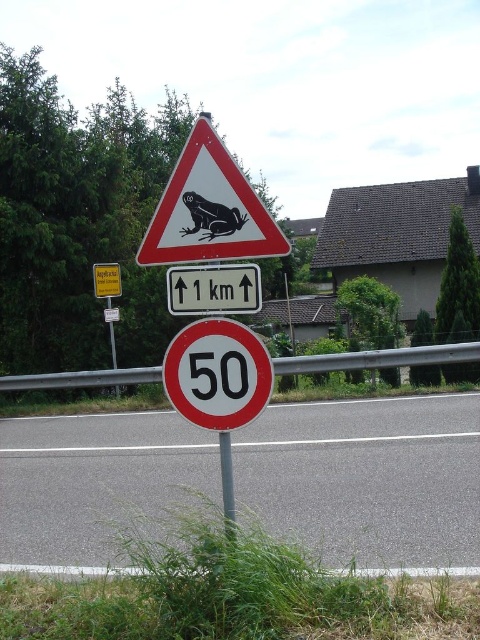
Is matte plastic frog at upper center in front of metallic pole at center?

Yes, matte plastic frog at upper center is closer to the viewer.

Does matte plastic frog at upper center appear on the left side of metallic pole at center?

No, matte plastic frog at upper center is not to the left of metallic pole at center.

The width and height of the screenshot is (480, 640). I want to click on matte plastic frog at upper center, so click(208, 209).

The width and height of the screenshot is (480, 640). What are the coordinates of `matte plastic frog at upper center` in the screenshot? It's located at (208, 209).

Between point (201, 339) and point (224, 445), which one is positioned behind?

The point (224, 445) is more distant.

Who is positioned more to the right, red metallic speed limit sign at center or metallic pole at center?

From the viewer's perspective, metallic pole at center appears more on the right side.

Is point (239, 381) behind point (230, 496)?

That is False.

I want to click on red metallic speed limit sign at center, so click(x=217, y=374).

Between point (228, 346) and point (99, 280), which one is positioned behind?

Positioned behind is point (99, 280).

Is red metallic speed limit sign at center to the right of yellow plastic sign at upper center from the viewer's perspective?

Correct, you'll find red metallic speed limit sign at center to the right of yellow plastic sign at upper center.

Is point (226, 328) positioned in front of point (119, 292)?

That is True.

Identify the location of red metallic speed limit sign at center. The height and width of the screenshot is (640, 480). (217, 374).